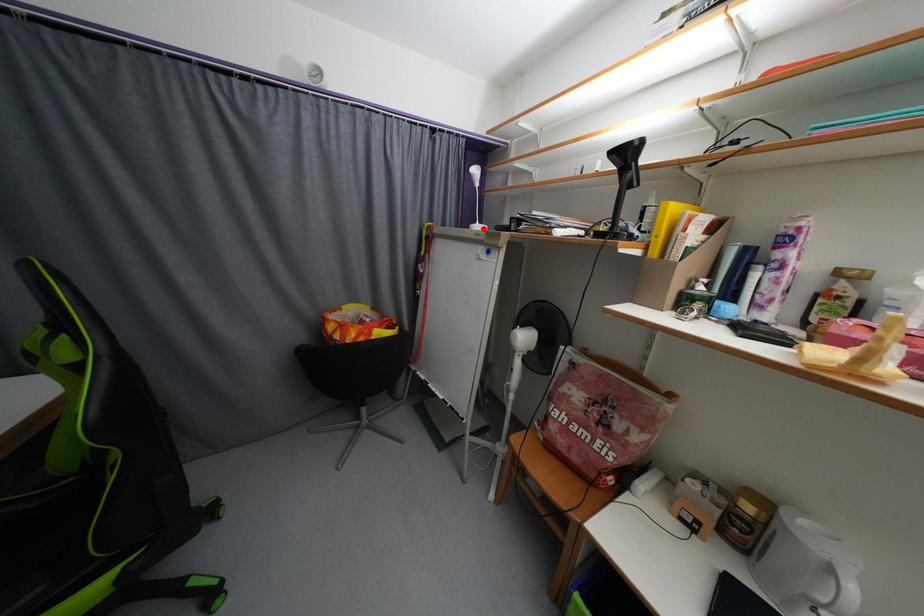
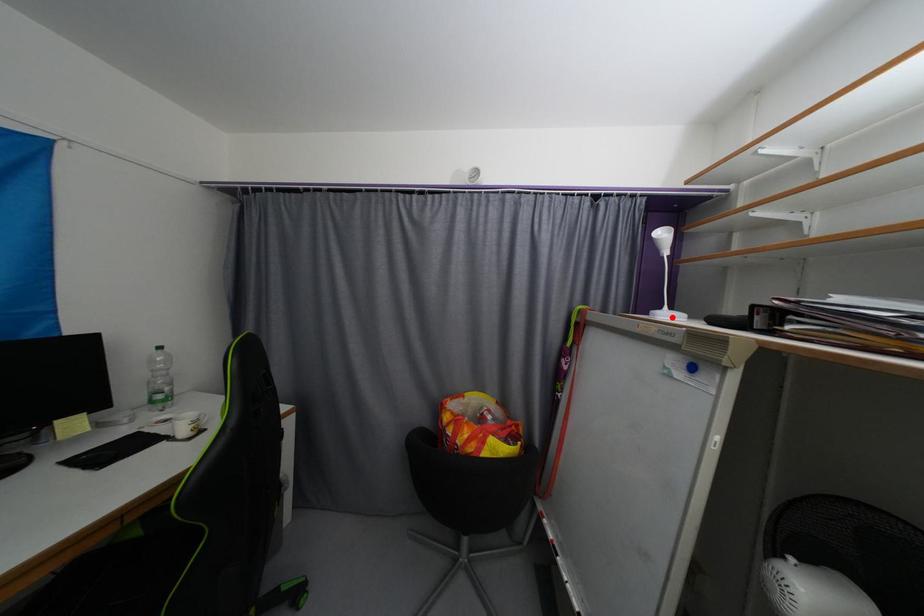
I am providing you with two images of the same scene from different viewpoints. A red point is marked on the first image and another point is marked on the second image. Is the marked point in image1 the same physical position as the marked point in image2?

Yes